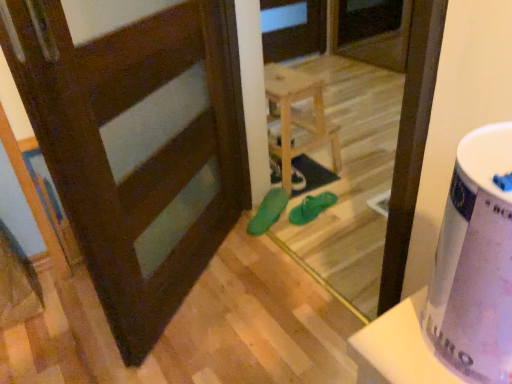
You are a GUI agent. You are given a task and a screenshot of the screen. Output one action in this format:
    pyautogui.click(x=<x>, y=<y>)
    Task: Click on the vacant space underneath green rubber flip-flops at center, which is the first footwear from right to left (from a real-world perspective)
    
    Given the screenshot: What is the action you would take?
    pyautogui.click(x=312, y=209)